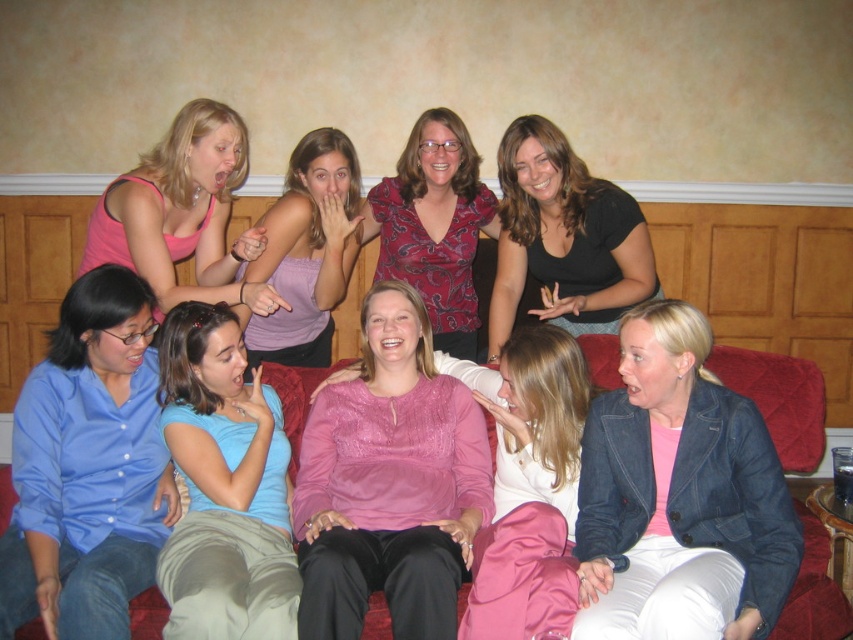
You are a photographer trying to capture a closeup shot of both the pink satin blouse at center and the light blue cotton shirt at lower left. Since the camera can only focus on one subject at a time, which clothing item should you focus on to ensure it appears larger in the photo?

The pink satin blouse at center is larger in size than the light blue cotton shirt at lower left, so focusing on the pink satin blouse at center will ensure it appears larger in the photo.

You are a photographer setting up for a group photo. The scene has a pink satin blouse at center and a light blue cotton shirt at lower left. You need to ensure that the distance between these two clothing items is at least 10 inches to avoid overcrowding. Based on the provided information, will the current arrangement meet your requirement?

The pink satin blouse at center is 9.81 inches from the light blue cotton shirt at lower left, which is slightly less than the required 10 inches. Therefore, the current arrangement does not meet the requirement and may require adjustment to increase the distance between them.

You are a photographer standing at the scene. You want to take a photo of the pink tank top at upper left and the red fabric couch at lower center. Can you position yourself so that both are in the frame without moving any objects? Explain your reasoning.

The pink tank top at upper left is 5.44 feet away from the red fabric couch at lower center. Since the distance between them is manageable, you can position yourself in a way that both are within the camera frame without needing to move any objects.